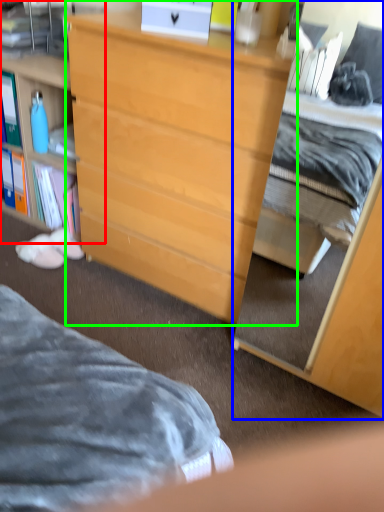
Question: Which object is positioned farthest from cabinetry (highlighted by a red box)? Select from cabinetry (highlighted by a blue box) and desk (highlighted by a green box).

Choices:
 (A) cabinetry
 (B) desk

Answer: (A)